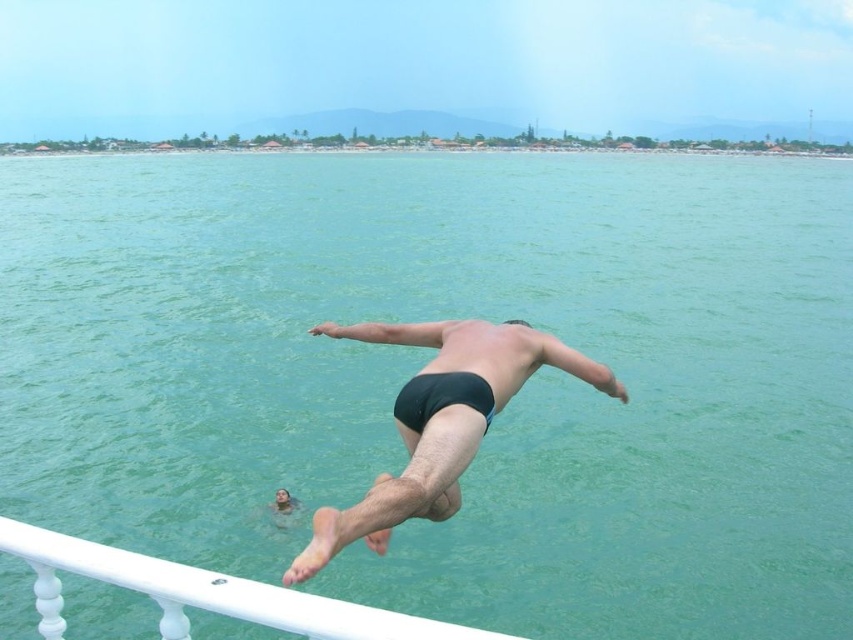
You are a photographer trying to capture the perfect shot of the diver. You notice the white glossy rail at lower left and the black matte swim trunks at lower center in your viewfinder. Which object should you focus on if you want to capture the larger one in your photo?

The white glossy rail at lower left is bigger than the black matte swim trunks at lower center, so you should focus on the white glossy rail at lower left to capture the larger object.

Based on the photo, you are a photographer trying to capture the perfect shot of the diver wearing the black matte swim trunks at center. Based on their current position coordinates, where should you position your camera to ensure they are centered in the frame?

The black matte swim trunks at center are located at coordinates point (399, 488), so positioning the camera at those coordinates will ensure the diver is centered in the frame.